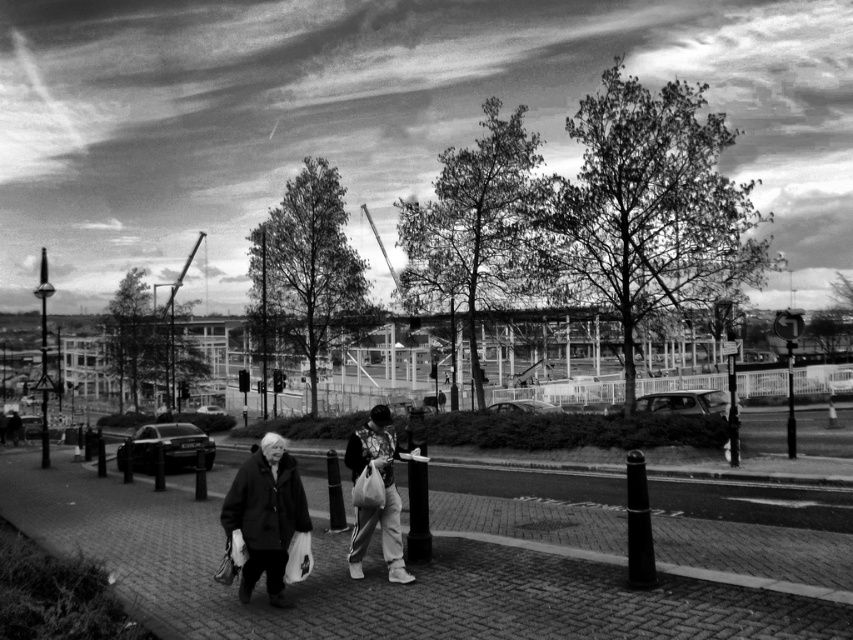
Question: Considering the real-world distances, which object is closest to the shiny metallic car at center?

Choices:
 (A) brick pavement at lower left
 (B) shiny metallic car at center-right
 (C) patterned fabric jacket at center

Answer: (B)

Question: Which of these objects is positioned closest to the patterned fabric jacket at center?

Choices:
 (A) shiny black sedan at center-left
 (B) brick pavement at lower left
 (C) dark wool coat at center

Answer: (C)

Question: Does dark wool coat at center lie behind shiny metallic car at center?

Choices:
 (A) no
 (B) yes

Answer: (A)

Question: Estimate the real-world distances between objects in this image. Which object is farther from the shiny metallic car at center-right?

Choices:
 (A) brick pavement at lower left
 (B) matte black jacket at center
 (C) patterned fabric jacket at center

Answer: (B)

Question: Does brick pavement at lower left come behind shiny metallic car at center?

Choices:
 (A) no
 (B) yes

Answer: (A)

Question: Is patterned fabric jacket at center to the left of shiny metallic car at center-right from the viewer's perspective?

Choices:
 (A) yes
 (B) no

Answer: (A)